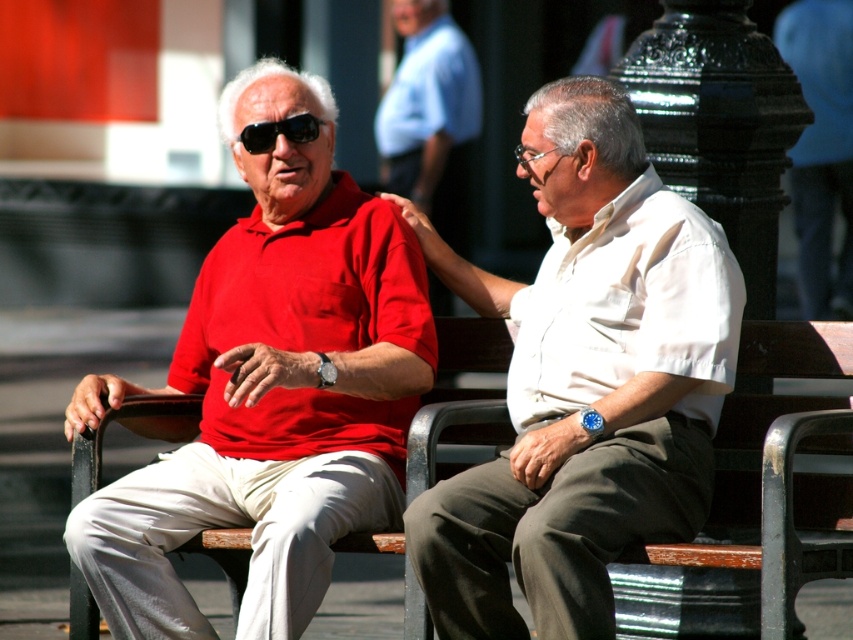
Is brown wooden bench at center further to camera compared to black matte sunglasses at upper left?

No, it is in front of black matte sunglasses at upper left.

Is point (787, 563) closer to camera compared to point (283, 120)?

That is True.

Where is `brown wooden bench at center`? The width and height of the screenshot is (853, 640). brown wooden bench at center is located at coordinates (775, 499).

From the picture: Does white matte shirt at center appear on the right side of brown wooden bench at center?

No, white matte shirt at center is not to the right of brown wooden bench at center.

Can you confirm if white matte shirt at center is thinner than brown wooden bench at center?

In fact, white matte shirt at center might be wider than brown wooden bench at center.

Does point (573, 419) come in front of point (808, 422)?

No, (573, 419) is behind (808, 422).

The height and width of the screenshot is (640, 853). Identify the location of white matte shirt at center. (584, 381).

Is matte red polo shirt at left below brown wooden bench at center?

Actually, matte red polo shirt at left is above brown wooden bench at center.

Is point (229, 419) farther from camera compared to point (453, 330)?

No.

What do you see at coordinates (270, 388) in the screenshot? I see `matte red polo shirt at left` at bounding box center [270, 388].

You are a GUI agent. You are given a task and a screenshot of the screen. Output one action in this format:
    pyautogui.click(x=<x>, y=<y>)
    Task: Click on the matte red polo shirt at left
    This screenshot has width=853, height=640.
    Given the screenshot: What is the action you would take?
    [270, 388]